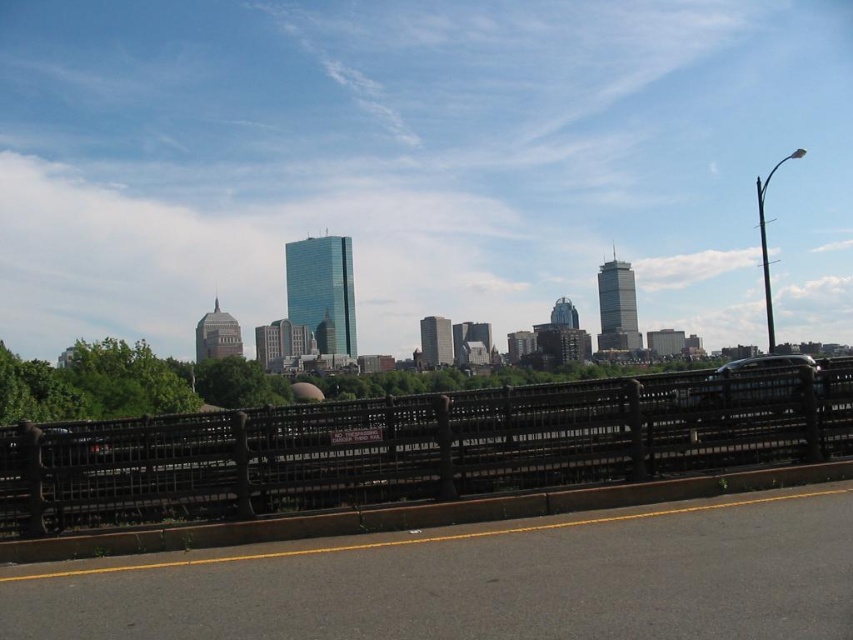
You are a delivery driver approaching the bridge and need to stay on the black asphalt highway at lower center. Are you able to see the black wrought iron fence at center from your current position?

The black asphalt highway at lower center is positioned under the black wrought iron fence at center, so the fence is blocking the view of the highway from above. Therefore, you cannot see the black wrought iron fence at center from your position on the highway.